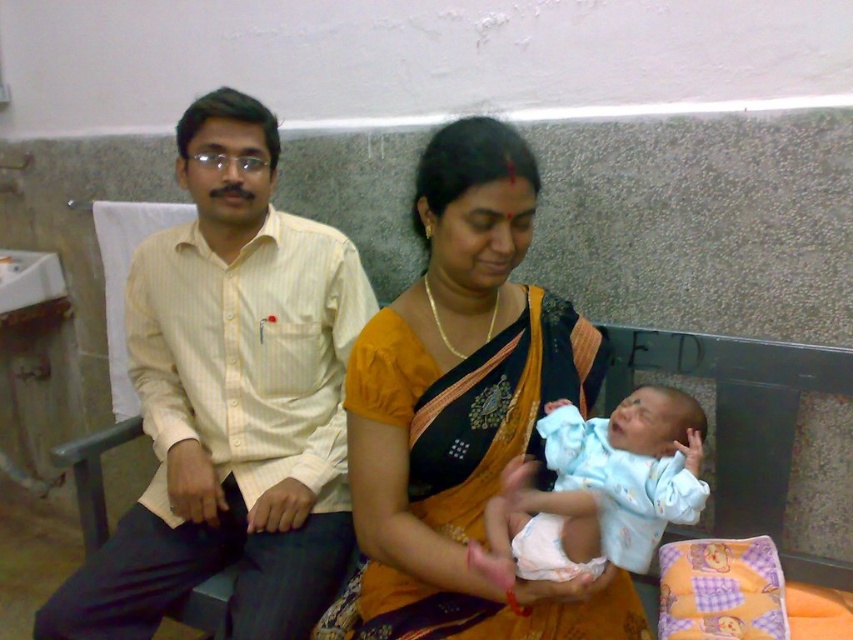
Can you confirm if yellow striped shirt at left is smaller than matte yellow sari at center?

Incorrect, yellow striped shirt at left is not smaller in size than matte yellow sari at center.

Is point (352, 256) less distant than point (352, 497)?

No.

Between point (166, 554) and point (636, 625), which one is positioned behind?

The point (166, 554) is more distant.

Find the location of `yellow striped shirt at left`. yellow striped shirt at left is located at coordinates (231, 401).

Is matte yellow sari at center in front of light blue fabric baby at center?

No, it is behind light blue fabric baby at center.

This screenshot has width=853, height=640. What do you see at coordinates (465, 406) in the screenshot? I see `matte yellow sari at center` at bounding box center [465, 406].

Is point (576, 324) positioned behind point (648, 454)?

That is True.

At what (x,y) coordinates should I click in order to perform the action: click on matte yellow sari at center. Please return your answer as a coordinate pair (x, y). Looking at the image, I should click on (465, 406).

Can you confirm if yellow striped shirt at left is positioned to the right of light blue fabric baby at center?

In fact, yellow striped shirt at left is to the left of light blue fabric baby at center.

Who is lower down, yellow striped shirt at left or light blue fabric baby at center?

light blue fabric baby at center is below.

You are a GUI agent. You are given a task and a screenshot of the screen. Output one action in this format:
    pyautogui.click(x=<x>, y=<y>)
    Task: Click on the yellow striped shirt at left
    
    Given the screenshot: What is the action you would take?
    pyautogui.click(x=231, y=401)